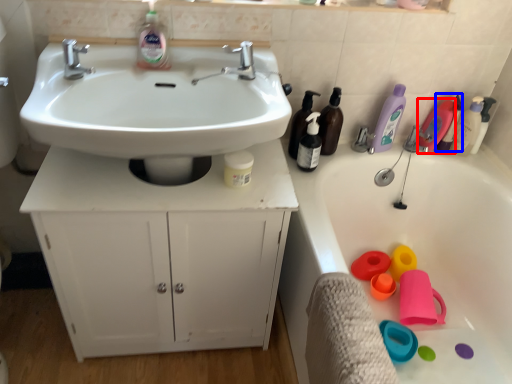
Question: Which object appears farthest to the camera in this image, cleaning product (highlighted by a red box) or cleaning product (highlighted by a blue box)?

Choices:
 (A) cleaning product
 (B) cleaning product

Answer: (A)